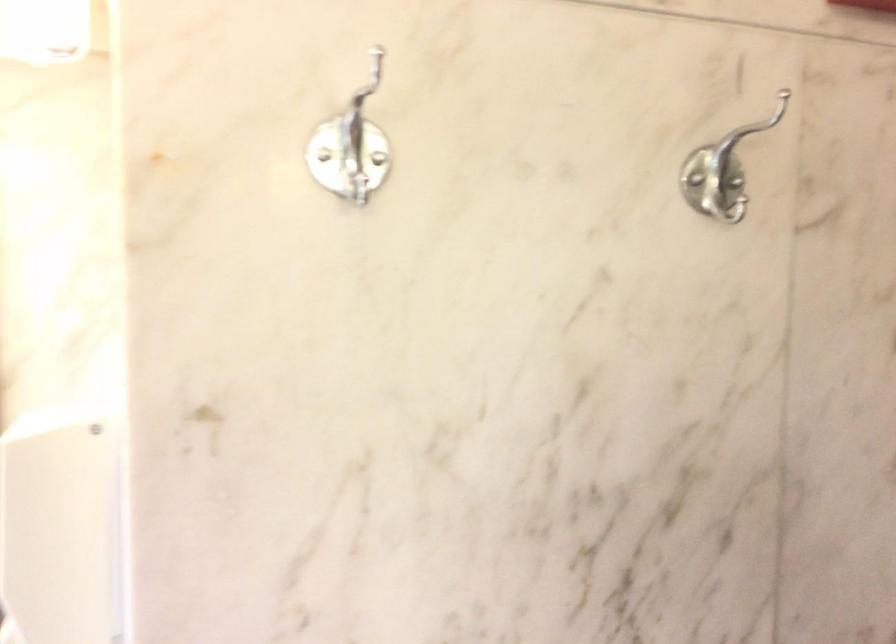
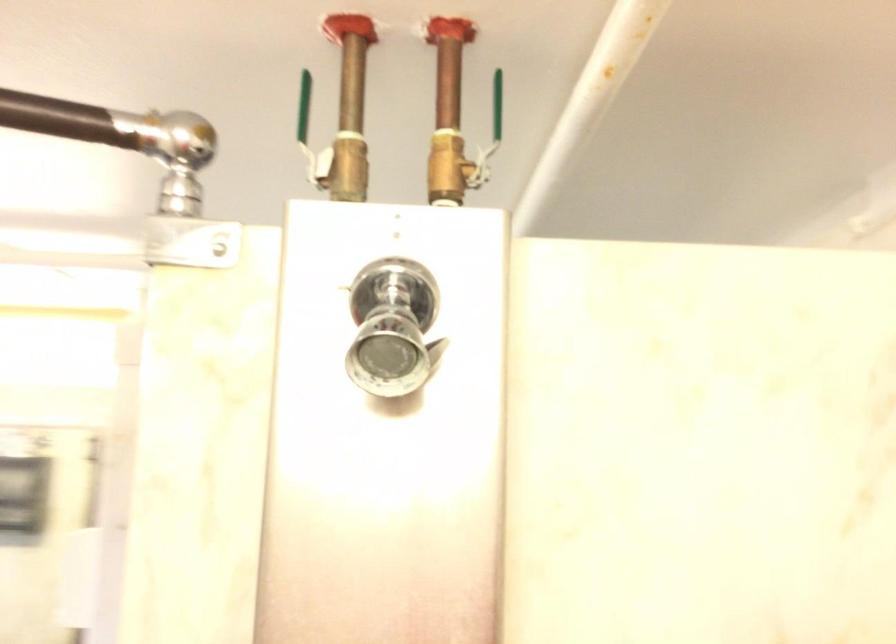
Question: I am providing you with two images of the same scene from different viewpoints. Please identify which objects are invisible in image2.

Choices:
 (A) green valve handle
 (B) small white plate
 (C) metal coat hook
 (D) shower head lever

Answer: (C)